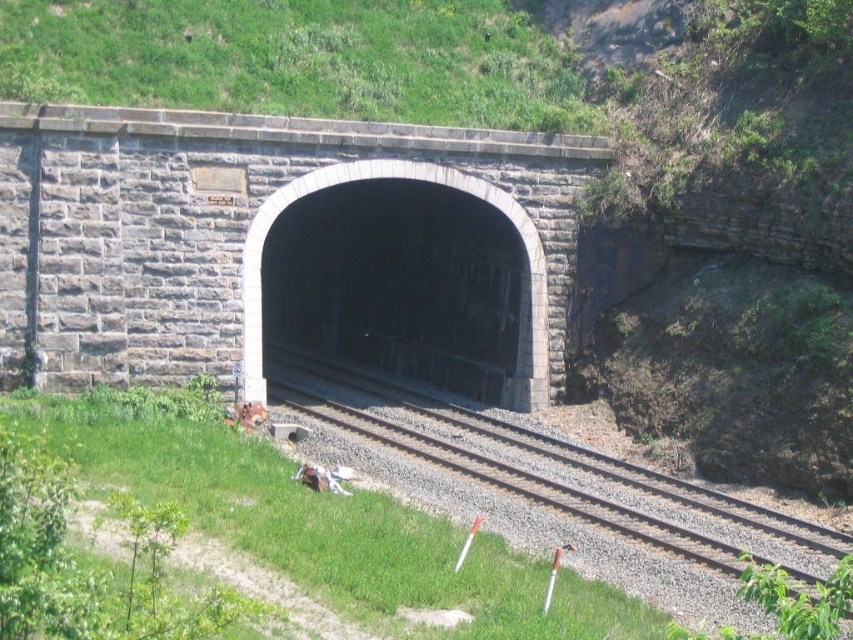
Question: Considering the relative positions of gravel railroad tracks at center and dark gray stone tunnel at center in the image provided, where is gravel railroad tracks at center located with respect to dark gray stone tunnel at center?

Choices:
 (A) below
 (B) above

Answer: (A)

Question: Considering the relative positions of gravel railroad tracks at center and dark gray stone tunnel at center in the image provided, where is gravel railroad tracks at center located with respect to dark gray stone tunnel at center?

Choices:
 (A) left
 (B) right

Answer: (B)

Question: Where is gravel railroad tracks at center located in relation to dark gray stone tunnel at center in the image?

Choices:
 (A) above
 (B) below

Answer: (B)

Question: Which object appears farthest from the camera in this image?

Choices:
 (A) gravel railroad tracks at center
 (B) dark gray stone tunnel at center

Answer: (B)